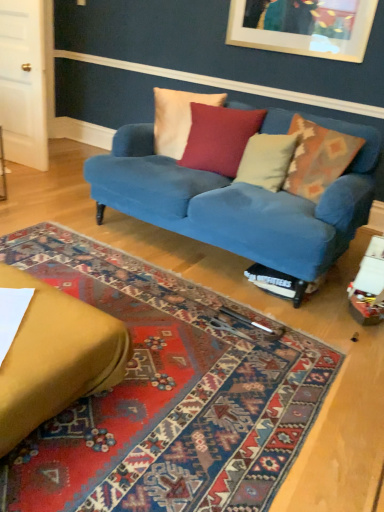
Where is `vacant area on top of velvet yellow studio couch at lower left, which ranks as the second studio couch in back-to-front order (from a real-world perspective)`? This screenshot has height=512, width=384. vacant area on top of velvet yellow studio couch at lower left, which ranks as the second studio couch in back-to-front order (from a real-world perspective) is located at coordinates (32, 315).